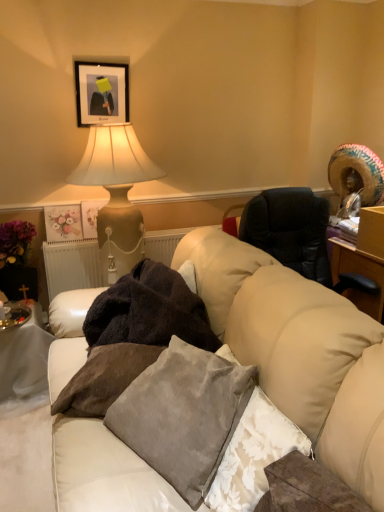
This screenshot has width=384, height=512. Identify the location of matte black picture frame at upper left. (101, 92).

Measure the distance between multicolored woven straw hat at upper right and camera.

multicolored woven straw hat at upper right is 2.49 meters from camera.

Measure the distance between point [66,210] and camera.

The depth of point [66,210] is 9.12 feet.

Describe the element at coordinates (317, 368) in the screenshot. The width and height of the screenshot is (384, 512). I see `white leather couch at center` at that location.

What do you see at coordinates (149, 311) in the screenshot?
I see `dark fuzzy blanket at center` at bounding box center [149, 311].

This screenshot has height=512, width=384. Describe the element at coordinates (24, 357) in the screenshot. I see `white fabric table at lower left` at that location.

At what (x,y) coordinates should I click in order to perform the action: click on velvet gray pillow at center, placed as the 2th pillow when sorted from right to left. Please return your answer as a coordinate pair (x, y). This screenshot has width=384, height=512. Looking at the image, I should click on (183, 415).

The height and width of the screenshot is (512, 384). Find the location of `matte black picture frame at upper left`. matte black picture frame at upper left is located at coordinates (101, 92).

Which object is positioned more to the left, velvet gray pillow at center, placed as the 2th pillow when sorted from right to left, or white leather couch at center?

Positioned to the left is velvet gray pillow at center, placed as the 2th pillow when sorted from right to left.

From the image's perspective, does velvet gray pillow at center, which appears as the 2th pillow when viewed from the left, appear lower than white leather couch at center?

No, from the image's perspective, velvet gray pillow at center, which appears as the 2th pillow when viewed from the left, is not below white leather couch at center.

Is velvet gray pillow at center, which appears as the 2th pillow when viewed from the left, looking in the opposite direction of white leather couch at center?

Yes.

Is point (99, 91) closer to camera compared to point (125, 467)?

No, (99, 91) is further to viewer.

Which object is closer to the camera taking this photo, matte black picture frame at upper left or white leather couch at center?

white leather couch at center is in front.

Which is correct: matte black picture frame at upper left is inside white leather couch at center, or outside of it?

The correct answer is: outside.

From the image's perspective, would you say velvet gray pillow at center, the 1th pillow from the right, is positioned over multicolored woven straw hat at upper right?

No, from the image's perspective, velvet gray pillow at center, the 1th pillow from the right, is not above multicolored woven straw hat at upper right.

Which point is more forward, (x=267, y=407) or (x=371, y=172)?

Positioned in front is point (x=267, y=407).

I want to click on the 3rd pillow below when counting from the multicolored woven straw hat at upper right (from the image's perspective), so click(254, 455).

Is white leather couch at center facing away from matte black picture frame at upper left?

No, matte black picture frame at upper left is not at the back of white leather couch at center.

Does point (97, 443) come behind point (102, 79)?

That is False.

Is white leather couch at center not near matte black picture frame at upper left?

Absolutely, white leather couch at center is distant from matte black picture frame at upper left.

How many degrees apart are the facing directions of white leather couch at center and matte black picture frame at upper left?

The angle between the facing direction of white leather couch at center and the facing direction of matte black picture frame at upper left is 90 degrees.

Is point (90, 373) farther from viewer compared to point (267, 487)?

That is True.

Is velvet gray pillow at center, which appears as the third pillow when viewed from the right, closer to camera compared to velvet gray pillow at center, marked as the 3th pillow in a left-to-right arrangement?

No, it is not.

How many degrees apart are the facing directions of velvet gray pillow at center, which appears as the first pillow when viewed from the left, and velvet gray pillow at center, the 1th pillow from the right?

They differ by 57.7 degrees in their facing directions.

From the image's perspective, relative to velvet gray pillow at center, the 1th pillow from the right, is velvet gray pillow at center, which appears as the first pillow when viewed from the left, above or below?

From the image's perspective, velvet gray pillow at center, which appears as the first pillow when viewed from the left, appears above velvet gray pillow at center, the 1th pillow from the right.

Can you confirm if matte beige lamp at upper left is smaller than velvet gray pillow at center, which appears as the third pillow when viewed from the right?

Actually, matte beige lamp at upper left might be larger than velvet gray pillow at center, which appears as the third pillow when viewed from the right.

From a real-world perspective, between matte beige lamp at upper left and velvet gray pillow at center, which appears as the first pillow when viewed from the left, who is vertically higher?

From a 3D spatial view, matte beige lamp at upper left is above.

Looking at this image, what's the angular difference between matte beige lamp at upper left and velvet gray pillow at center, which appears as the first pillow when viewed from the left,'s facing directions?

The facing directions of matte beige lamp at upper left and velvet gray pillow at center, which appears as the first pillow when viewed from the left, are 30.9 degrees apart.

Which is correct: matte beige lamp at upper left is inside velvet gray pillow at center, which appears as the third pillow when viewed from the right, or outside of it?

matte beige lamp at upper left is located beyond the bounds of velvet gray pillow at center, which appears as the third pillow when viewed from the right.

Which of these two, matte beige lamp at upper left or multicolored woven straw hat at upper right, is wider?

With larger width is matte beige lamp at upper left.

You are a GUI agent. You are given a task and a screenshot of the screen. Output one action in this format:
    pyautogui.click(x=<x>, y=<y>)
    Task: Click on the lamp located on the left of multicolored woven straw hat at upper right
    The height and width of the screenshot is (512, 384).
    Given the screenshot: What is the action you would take?
    pyautogui.click(x=116, y=193)

Is matte beige lamp at upper left positioned far away from multicolored woven straw hat at upper right?

Indeed, matte beige lamp at upper left is not near multicolored woven straw hat at upper right.

Which is more to the right, matte beige lamp at upper left or multicolored woven straw hat at upper right?

multicolored woven straw hat at upper right is more to the right.

The height and width of the screenshot is (512, 384). Identify the location of studio couch on the right of velvet gray pillow at center, which appears as the 2th pillow when viewed from the left. (317, 368).

What are the coordinates of `picture frame located above the white leather couch at center (from a real-world perspective)` in the screenshot? It's located at (101, 92).

Considering their positions, is matte black picture frame at upper left positioned closer to white leather couch at center than multicolored woven straw hat at upper right?

multicolored woven straw hat at upper right is positioned closer to the anchor white leather couch at center.

Estimate the real-world distances between objects in this image. Which object is closer to velvet gray pillow at center, which appears as the 2th pillow when viewed from the left, multicolored woven straw hat at upper right or white leather couch at center?

white leather couch at center is closer to velvet gray pillow at center, which appears as the 2th pillow when viewed from the left.

Looking at the image, which one is located closer to velvet gray pillow at center, the 1th pillow from the right, velvet gray pillow at center, which appears as the first pillow when viewed from the left, or dark fuzzy blanket at center?

velvet gray pillow at center, which appears as the first pillow when viewed from the left, is closer to velvet gray pillow at center, the 1th pillow from the right.

Based on their spatial positions, is matte black picture frame at upper left or dark fuzzy blanket at center further from matte floral print at upper left?

Based on the image, dark fuzzy blanket at center appears to be further to matte floral print at upper left.

Based on their spatial positions, is matte floral print at upper left or white leather couch at center closer to dark fuzzy blanket at center?

Based on the image, white leather couch at center appears to be nearer to dark fuzzy blanket at center.

Considering their positions, is velvet gray pillow at center, the 1th pillow from the right, positioned further to matte black picture frame at upper left than white leather couch at center?

velvet gray pillow at center, the 1th pillow from the right, lies further to matte black picture frame at upper left than the other object.

Considering their positions, is dark fuzzy blanket at center positioned closer to white leather couch at center than multicolored woven straw hat at upper right?

dark fuzzy blanket at center is positioned closer to the anchor white leather couch at center.

Estimate the real-world distances between objects in this image. Which object is closer to white leather couch at center, multicolored woven straw hat at upper right or matte floral print at upper left?

multicolored woven straw hat at upper right is closer to white leather couch at center.

Where is `lamp between matte black picture frame at upper left and velvet gray pillow at center, the 1th pillow from the right, in the vertical direction`? Image resolution: width=384 pixels, height=512 pixels. lamp between matte black picture frame at upper left and velvet gray pillow at center, the 1th pillow from the right, in the vertical direction is located at coordinates (116, 193).

This screenshot has height=512, width=384. What are the coordinates of `material between white leather couch at center and matte beige lamp at upper left along the z-axis` in the screenshot? It's located at (149, 311).

Locate an element on the screen. straw hat between velvet gray pillow at center, placed as the 2th pillow when sorted from right to left, and matte black picture frame at upper left, along the z-axis is located at coordinates (358, 170).

I want to click on material situated between matte floral print at upper left and multicolored woven straw hat at upper right from left to right, so click(149, 311).